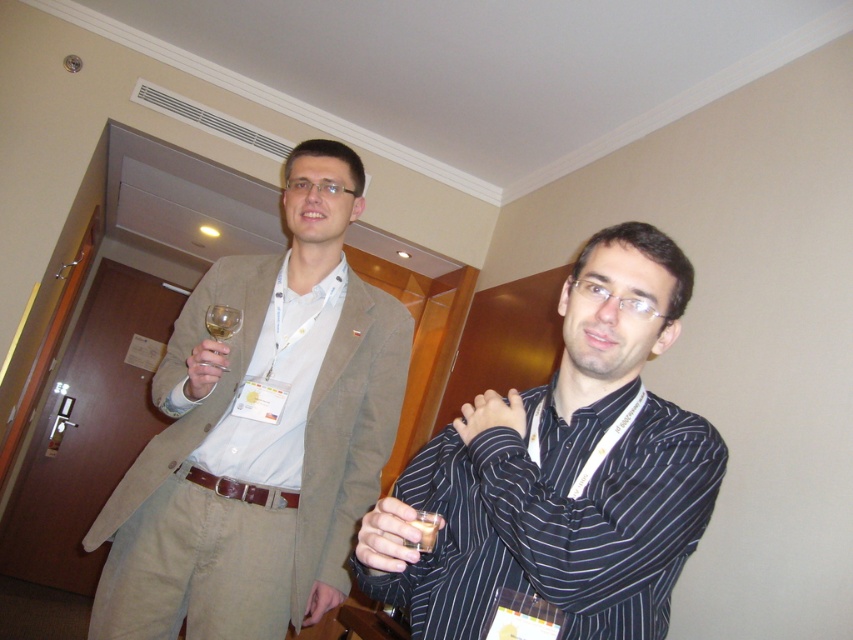
Between matte glass wine glass at upper left and translucent glass at center, which one has more height?

matte glass wine glass at upper left

How much distance is there between matte glass wine glass at upper left and translucent glass at center?

The distance of matte glass wine glass at upper left from translucent glass at center is 24.51 inches.

This screenshot has width=853, height=640. Identify the location of matte glass wine glass at upper left. [204, 368].

Is light brown textured blazer at center bigger than translucent glass at center?

Correct, light brown textured blazer at center is larger in size than translucent glass at center.

Who is taller, light brown textured blazer at center or translucent glass at center?

Standing taller between the two is light brown textured blazer at center.

The image size is (853, 640). What do you see at coordinates (260, 435) in the screenshot?
I see `light brown textured blazer at center` at bounding box center [260, 435].

At what (x,y) coordinates should I click in order to perform the action: click on light brown textured blazer at center. Please return your answer as a coordinate pair (x, y). This screenshot has height=640, width=853. Looking at the image, I should click on [260, 435].

This screenshot has height=640, width=853. What do you see at coordinates (260, 435) in the screenshot?
I see `light brown textured blazer at center` at bounding box center [260, 435].

Is light brown textured blazer at center above black striped shirt at center?

Yes.

Locate an element on the screen. light brown textured blazer at center is located at coordinates (260, 435).